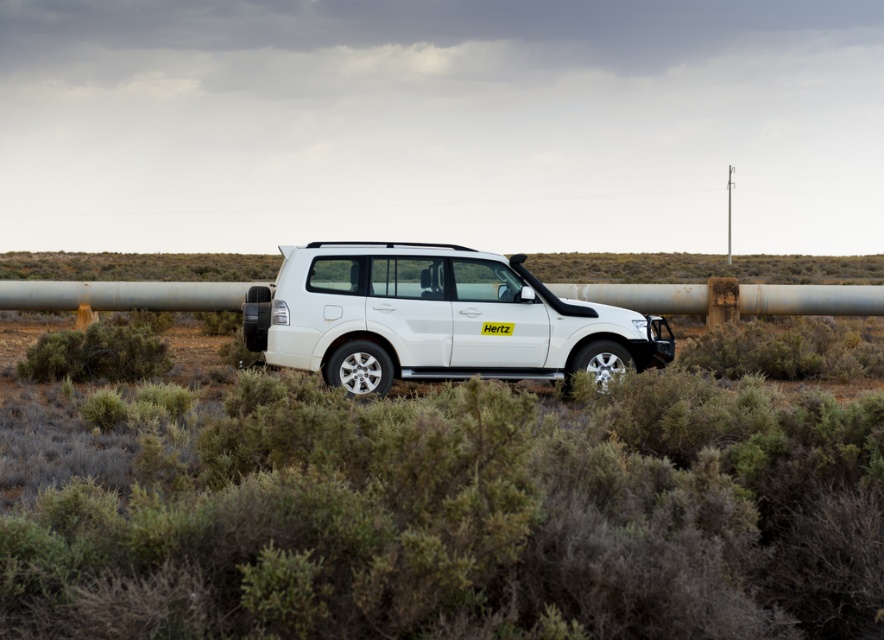
You are a photographer planning to take a wide shot of the white matte suv at center and the green shrubbery at center. Based on their sizes, which object would appear smaller in the photo?

The green shrubbery at center would appear smaller in the photo because it is thinner than the white matte suv at center.

From the picture: You are a photographer planning to take a photo of the white SUV parked in the desert. You want to ensure that both the green shrubbery at center and the brown shrub at lower left are visible in the frame. Which shrub should you position closer to the SUV to include both in the photo without overcrowding the composition?

The green shrubbery at center is smaller than the brown shrub at lower left, so positioning the smaller green shrubbery at center closer to the SUV would allow both to fit in the frame without overcrowding.